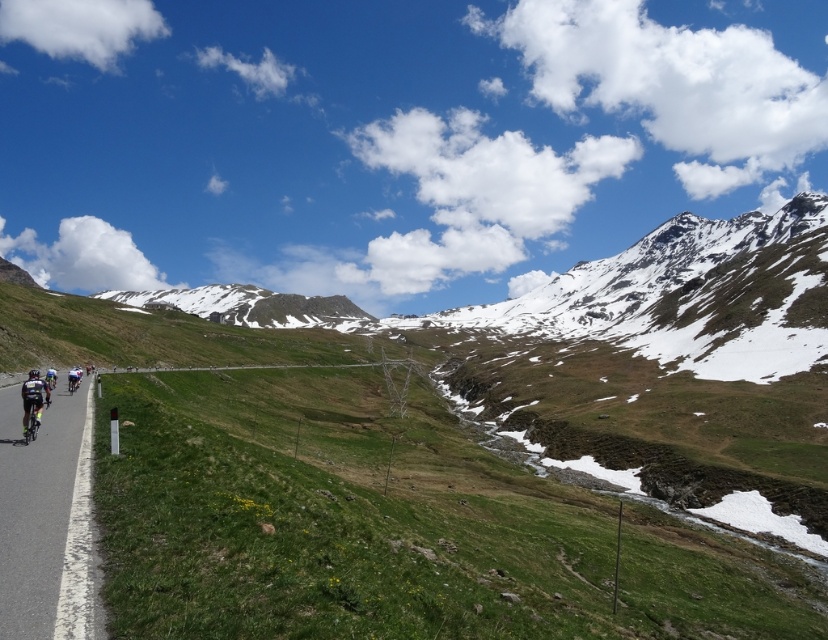
You are a hiker standing at the starting point of the mountain trail. Your goal is to reach the snowy rock mountain at upper center. The trail is 1140.04 feet long. If you can walk at a speed of 3 feet per second, how many minutes will it take you to reach the mountain?

The distance between the snowy rock mountain at upper center and the viewer is 1140.04 feet. At a walking speed of 3 feet per second, it would take 1140.04 divided by 3 equals approximately 380.01 seconds. Converting seconds to minutes, divide by 60, resulting in about 6.33 minutes. So, it will take approximately 6.33 minutes to reach the snowy rock mountain at upper center.

You are a cyclist planning to ride along the paved road. You notice the snowy rock mountain at upper center and the shiny silver bicycle at left. Which object is wider from your perspective?

The snowy rock mountain at upper center might be wider than the shiny silver bicycle at left.

You are a cyclist approaching the shiny black bicycle at left and the snowy rock mountain at upper center. Which object will you encounter first as you move forward along the road?

You will encounter the shiny black bicycle at left first because it is closer to you than the snowy rock mountain at upper center, which is further away.